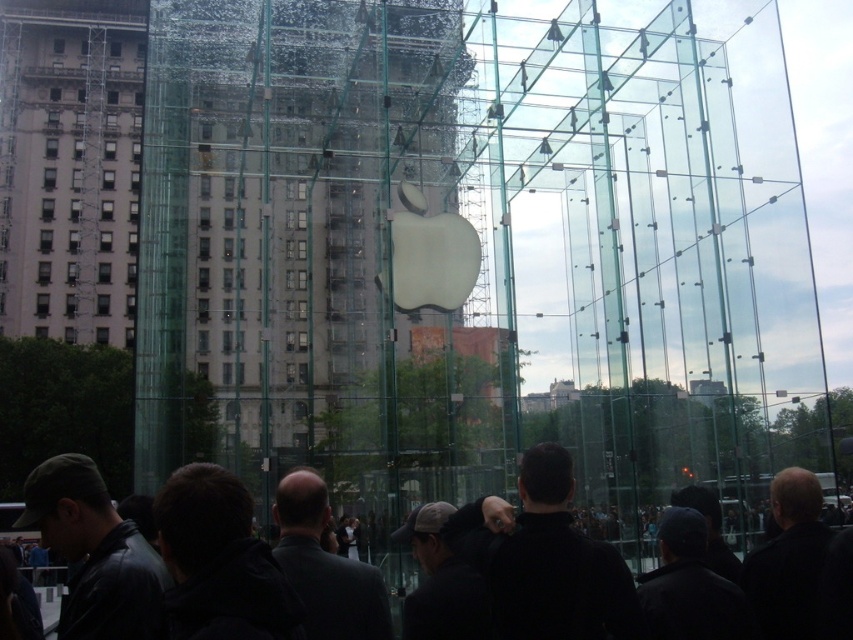
Question: Among these objects, which one is farthest from the camera?

Choices:
 (A) dark gray jacket at center
 (B) transparent glass cube at center

Answer: (B)

Question: Can you confirm if transparent glass cube at center is positioned below dark gray jacket at center?

Choices:
 (A) yes
 (B) no

Answer: (B)

Question: Can you confirm if transparent glass cube at center is bigger than dark gray jacket at center?

Choices:
 (A) no
 (B) yes

Answer: (B)

Question: In this image, where is transparent glass cube at center located relative to dark gray jacket at center?

Choices:
 (A) left
 (B) right

Answer: (A)

Question: Which point appears closest to the camera in this image?

Choices:
 (A) (94, 476)
 (B) (723, 161)

Answer: (A)

Question: Which point appears farthest from the camera in this image?

Choices:
 (A) (811, 513)
 (B) (158, 284)

Answer: (B)